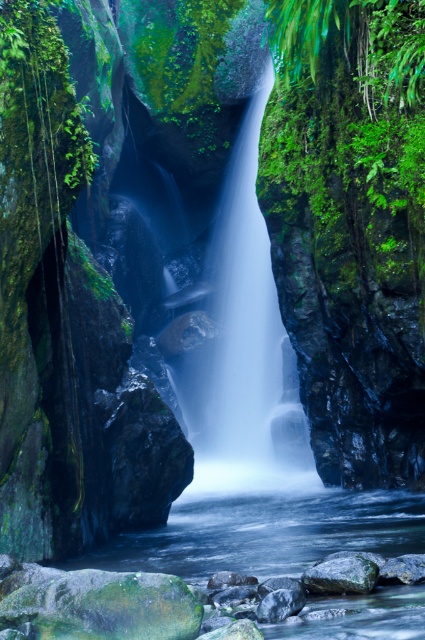
Based on the photo, who is shorter, white misty waterfall at center or green mossy rock at lower center?

With less height is green mossy rock at lower center.

Can you confirm if white misty waterfall at center is shorter than green mossy rock at lower center?

No.

Where is `white misty waterfall at center`? white misty waterfall at center is located at coordinates (244, 349).

Does white misty waterfall at center have a larger size compared to clear water at center?

Correct, white misty waterfall at center is larger in size than clear water at center.

The width and height of the screenshot is (425, 640). In order to click on white misty waterfall at center in this screenshot , I will do `click(244, 349)`.

Between clear water at center and green mossy rock at lower center, which one is positioned lower?

clear water at center is below.

Between clear water at center and green mossy rock at lower center, which one appears on the left side from the viewer's perspective?

clear water at center is more to the left.

Where is `clear water at center`? The height and width of the screenshot is (640, 425). clear water at center is located at coordinates (x=266, y=532).